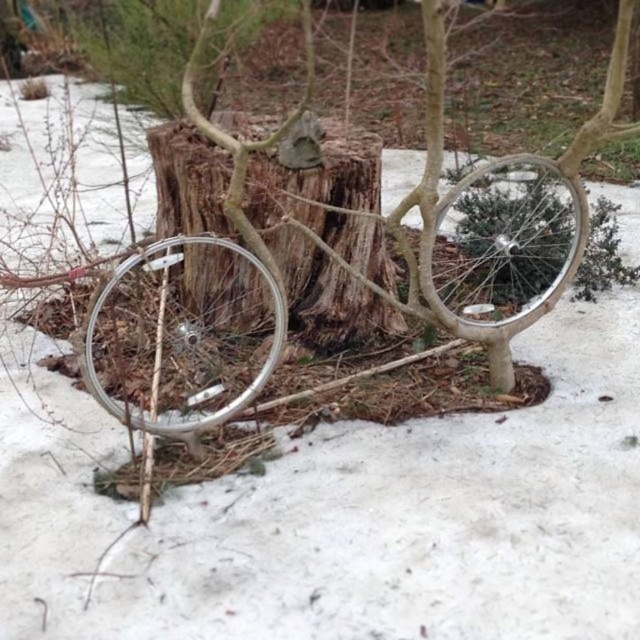
You are standing in front of the tree stump bicycle. If you want to place a small decoration between the silver metallic wheel at left and the wooden tree stump at center, where should you place it?

You should place the small decoration between the silver metallic wheel at left and the wooden tree stump at center, as the silver metallic wheel at left is positioned on the left side of the wooden tree stump at center.

From the picture: You are a delivery person who needs to place a package between the silver metallic bicycle at center and the wooden tree stump at center. The package measures 50 centimeters in length. Will there be enough space between them to fit the package?

The silver metallic bicycle at center and wooden tree stump at center are 54.44 centimeters apart. Since the package is 50 centimeters long, there is enough space to fit it between them as 54.44 cm is greater than 50 cm.

You are standing in front of the tree stump bicycle. There are two points marked on it, one at coordinate point [248,348] and another at point [257,125]. If you want to touch the point that is nearer to you, which coordinate should you aim for?

You should aim for point [248,348] because it is closer to the camera than point [257,125].